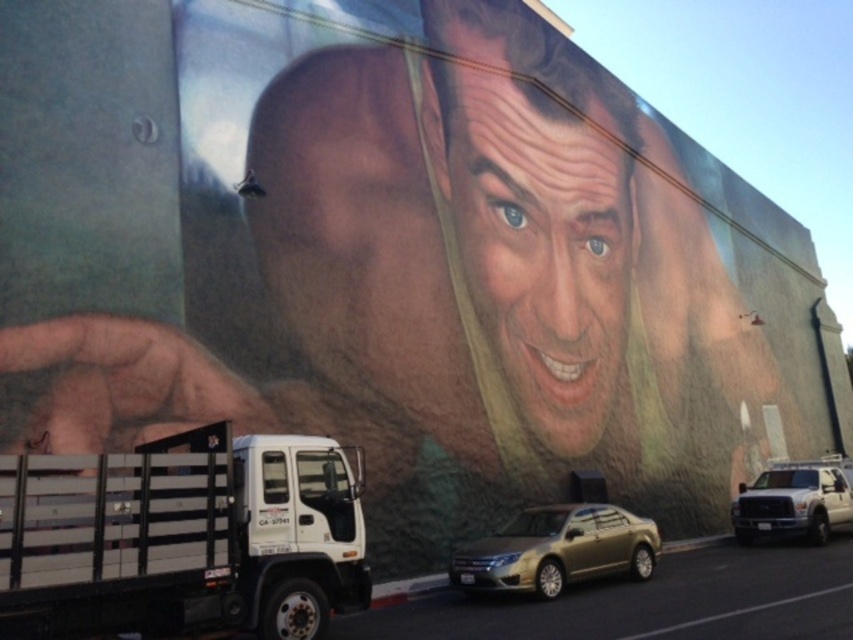
Between point (548, 276) and point (788, 525), which one is positioned behind?

The point (548, 276) is more distant.

Does smooth skin face at center have a larger size compared to white matte truck at lower right?

Correct, smooth skin face at center is larger in size than white matte truck at lower right.

Identify the location of smooth skin face at center. [541, 250].

Where is `smooth skin face at center`? smooth skin face at center is located at coordinates 541,250.

Which of these two, white matte truck at lower left or gold metallic sedan at center, stands taller?

white matte truck at lower left is taller.

Which is more to the left, white matte truck at lower left or gold metallic sedan at center?

white matte truck at lower left

This screenshot has height=640, width=853. What are the coordinates of `white matte truck at lower left` in the screenshot? It's located at (183, 538).

Does gold metallic sedan at center appear on the right side of white matte truck at lower right?

In fact, gold metallic sedan at center is to the left of white matte truck at lower right.

Is the position of gold metallic sedan at center more distant than that of white matte truck at lower right?

That is False.

Between point (517, 552) and point (804, 509), which one is positioned in front?

Point (517, 552) is in front.

I want to click on gold metallic sedan at center, so click(x=556, y=548).